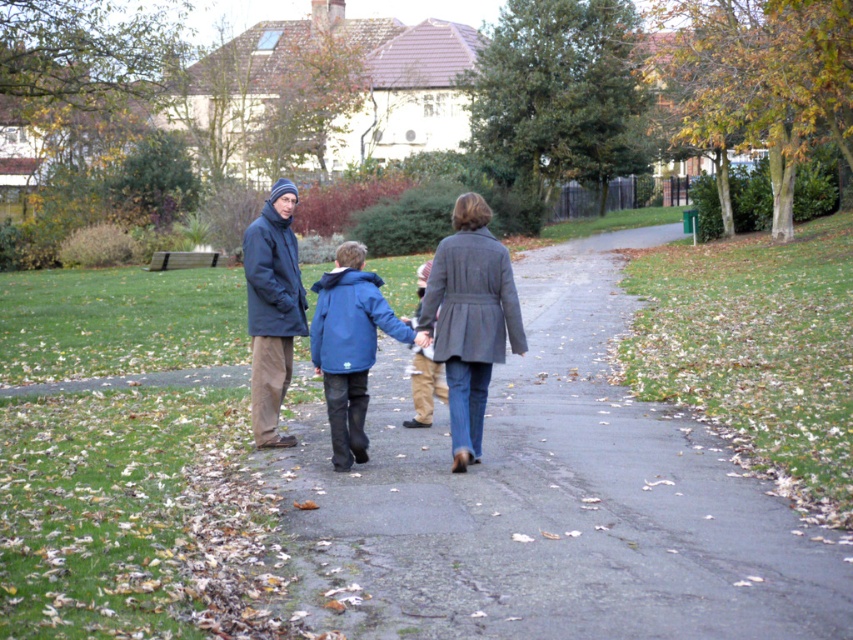
Between point (357, 381) and point (352, 273), which one is positioned behind?

The point (357, 381) is behind.

Does matte blue coat at center have a larger size compared to blue matte jacket at center?

No, matte blue coat at center is not bigger than blue matte jacket at center.

The image size is (853, 640). I want to click on matte blue coat at center, so click(350, 348).

From the picture: Is matte blue coat at center wider than matte dark blue coat at left?

Yes.

Can you confirm if matte blue coat at center is smaller than matte dark blue coat at left?

Yes, matte blue coat at center is smaller than matte dark blue coat at left.

The width and height of the screenshot is (853, 640). What do you see at coordinates (350, 348) in the screenshot?
I see `matte blue coat at center` at bounding box center [350, 348].

Identify the location of matte blue coat at center. (350, 348).

Is point (506, 518) closer to viewer compared to point (456, 381)?

Yes, point (506, 518) is closer to viewer.

Can you confirm if gray asphalt pavement at center is positioned below gray wool coat at center?

Indeed, gray asphalt pavement at center is positioned under gray wool coat at center.

Locate an element on the screen. This screenshot has height=640, width=853. gray asphalt pavement at center is located at coordinates [x=552, y=499].